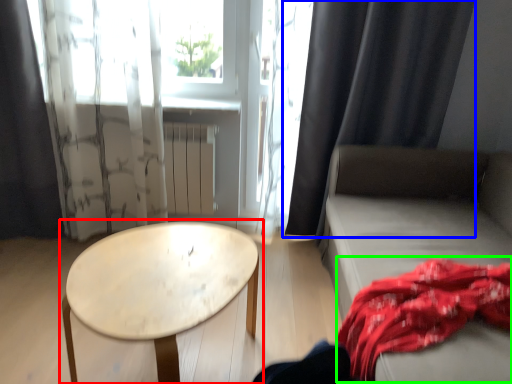
Question: Which object is positioned farthest from table (highlighted by a red box)? Select from curtain (highlighted by a blue box) and blanket (highlighted by a green box).

Choices:
 (A) curtain
 (B) blanket

Answer: (A)